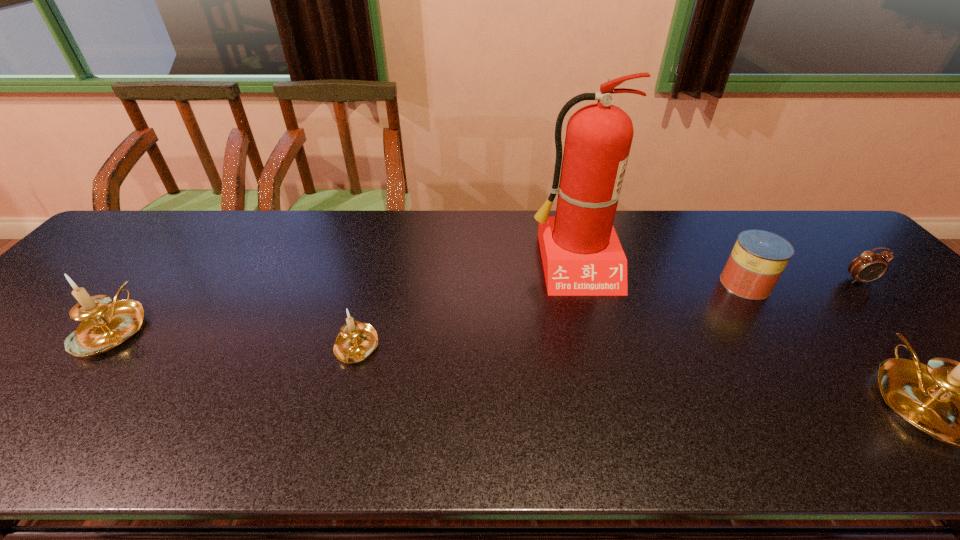
To achieve uniform spacing by inserting another candle_holder among them, please point to a free space for this new candle_holder. Please provide its 2D coordinates. Your answer should be formatted as a tuple, i.e. [(x, y)], where the tuple contains the x and y coordinates of a point satisfying the conditions above.

[(623, 373)]